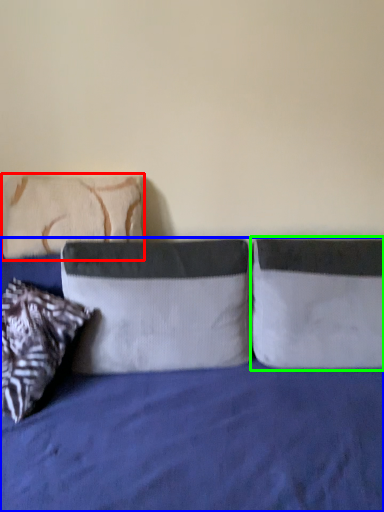
Question: Which object is the closest to the pillow (highlighted by a red box)? Choose among these: bed (highlighted by a blue box) or pillow (highlighted by a green box).

Choices:
 (A) bed
 (B) pillow

Answer: (A)